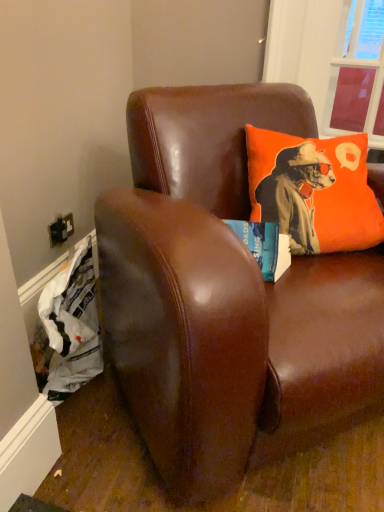
Question: From a real-world perspective, is brown leather couch at upper center above or below transparent plastic window screen at upper right?

Choices:
 (A) below
 (B) above

Answer: (A)

Question: In terms of width, does brown leather couch at upper center look wider or thinner when compared to transparent plastic window screen at upper right?

Choices:
 (A) thin
 (B) wide

Answer: (B)

Question: Which of these objects is positioned farthest from the brown leather couch at upper center?

Choices:
 (A) transparent plastic window screen at upper right
 (B) orange fabric pillow at upper right

Answer: (A)

Question: Which object is positioned closest to the orange fabric pillow at upper right?

Choices:
 (A) brown leather couch at upper center
 (B) transparent plastic window screen at upper right

Answer: (A)